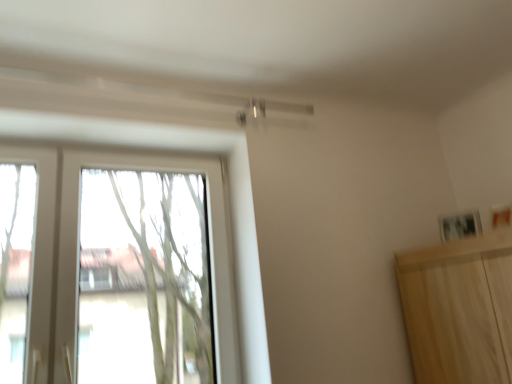
Where is `transparent glass window at left`? The height and width of the screenshot is (384, 512). transparent glass window at left is located at coordinates (77, 237).

What is the approximate width of transparent glass window at left?

transparent glass window at left is 5.73 inches wide.

Measure the distance between transparent glass window at left and camera.

They are 1.49 meters apart.

This screenshot has height=384, width=512. What do you see at coordinates (77, 237) in the screenshot?
I see `transparent glass window at left` at bounding box center [77, 237].

Find the location of `transparent glass window at left`. transparent glass window at left is located at coordinates (77, 237).